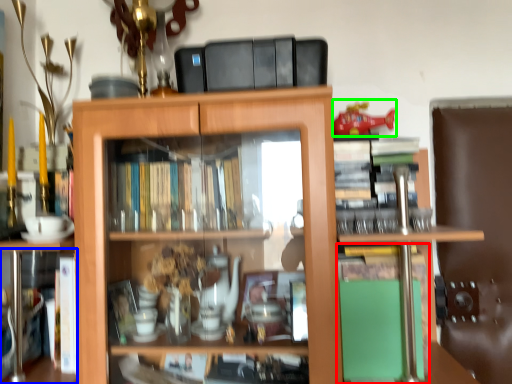
Question: Which is nearer to the book (highlighted by a red box)? book (highlighted by a blue box) or toy (highlighted by a green box).

Choices:
 (A) book
 (B) toy

Answer: (B)